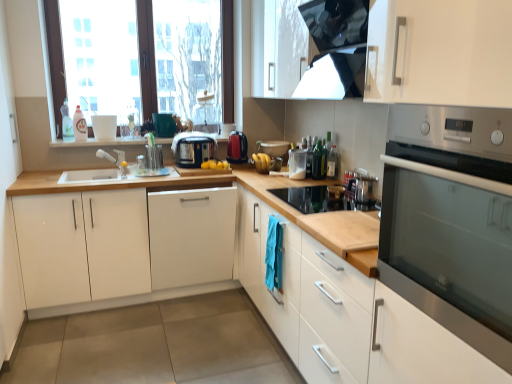
Question: Which direction should I rotate to look at green glass bottle at center, which appears as the 2th bottle when viewed from the front, — up or down?

Choices:
 (A) down
 (B) up

Answer: (B)

Question: Is satin silver toaster at upper right, the first appliance from the right, bigger than transparent plastic bottle at upper right, the third bottle positioned from the back?

Choices:
 (A) no
 (B) yes

Answer: (B)

Question: Is transparent plastic bottle at upper right, the third bottle positioned from the back, at the back of satin silver toaster at upper right, which is the 3th appliance from back to front?

Choices:
 (A) yes
 (B) no

Answer: (B)

Question: Does satin silver toaster at upper right, placed as the 1th appliance when sorted from front to back, have a greater width compared to transparent plastic bottle at upper right, the third bottle positioned from the back?

Choices:
 (A) yes
 (B) no

Answer: (A)

Question: Does satin silver toaster at upper right, placed as the 1th appliance when sorted from front to back, appear on the left side of transparent plastic bottle at upper right, placed as the third bottle when sorted from left to right?

Choices:
 (A) no
 (B) yes

Answer: (A)

Question: From the image's perspective, is satin silver toaster at upper right, placed as the 1th appliance when sorted from bottom to top, under transparent plastic bottle at upper right, which appears as the 1th bottle when viewed from the front?

Choices:
 (A) yes
 (B) no

Answer: (A)

Question: Is transparent plastic bottle at upper right, arranged as the first bottle when viewed from the right, surrounded by satin silver toaster at upper right, which is counted as the third appliance, starting from the left?

Choices:
 (A) yes
 (B) no

Answer: (B)

Question: Is green glass bottle at center, which appears as the 2th bottle when viewed from the front, not inside stainless steel oven at right?

Choices:
 (A) no
 (B) yes

Answer: (B)

Question: From the image's perspective, would you say green glass bottle at center, arranged as the second bottle when viewed from the back, is positioned over stainless steel oven at right?

Choices:
 (A) yes
 (B) no

Answer: (A)

Question: Does green glass bottle at center, the second bottle from the right, come behind stainless steel oven at right?

Choices:
 (A) yes
 (B) no

Answer: (A)

Question: Is green glass bottle at center, arranged as the second bottle when viewed from the back, in front of stainless steel oven at right?

Choices:
 (A) yes
 (B) no

Answer: (B)

Question: From a real-world perspective, does green glass bottle at center, arranged as the second bottle when viewed from the back, stand above stainless steel oven at right?

Choices:
 (A) yes
 (B) no

Answer: (B)

Question: Can you confirm if green glass bottle at center, the second bottle from the right, is thinner than stainless steel oven at right?

Choices:
 (A) yes
 (B) no

Answer: (A)

Question: Is green glass bottle at center, which appears as the 2th bottle when viewed from the front, wider than black plastic toaster at center, positioned as the 1th kitchen appliance in left-to-right order?

Choices:
 (A) no
 (B) yes

Answer: (A)